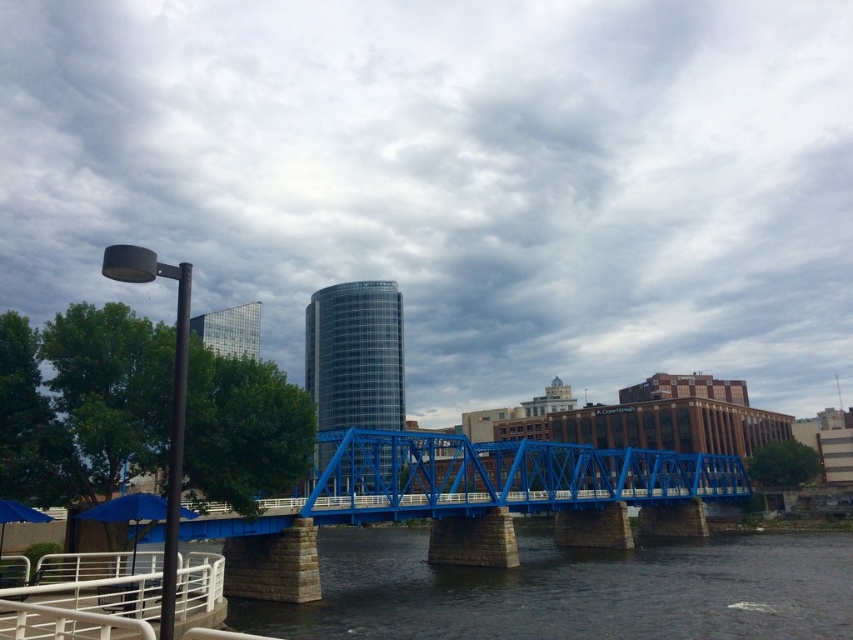
Does dark gray stone river at center appear on the left side of blue metallic bridge at center?

No, dark gray stone river at center is not to the left of blue metallic bridge at center.

Which is below, dark gray stone river at center or blue metallic bridge at center?

dark gray stone river at center is lower down.

Is point (770, 568) positioned after point (498, 484)?

No, (770, 568) is in front of (498, 484).

Locate an element on the screen. This screenshot has width=853, height=640. dark gray stone river at center is located at coordinates (570, 589).